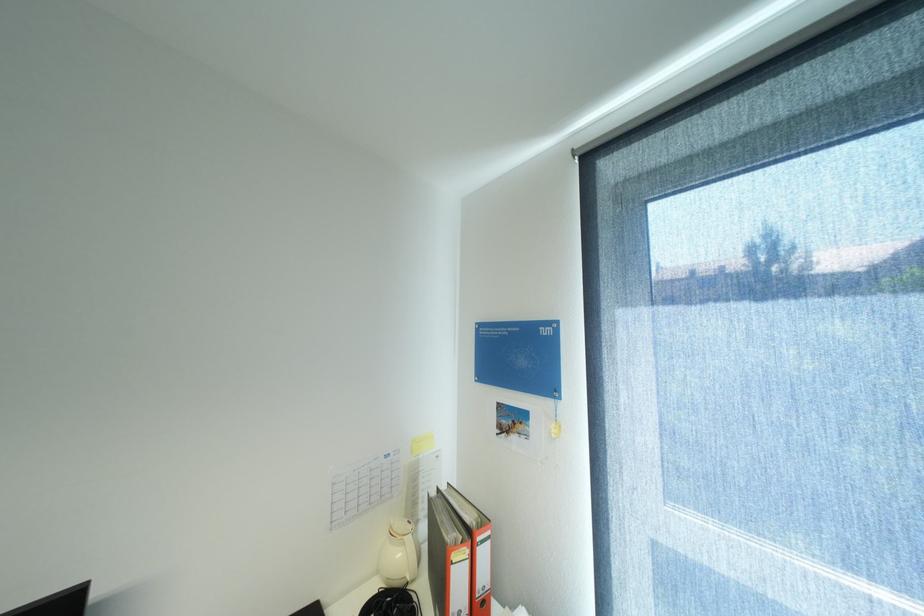
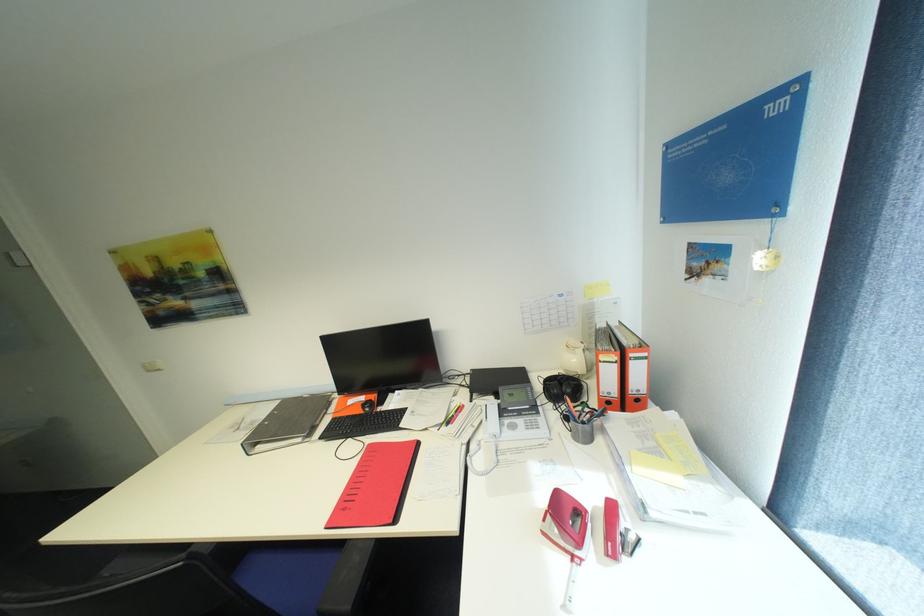
In the scene shown: The first image is from the beginning of the video and the second image is from the end. How did the camera likely rotate when shooting the video?

The rotation direction of the camera is left-down.